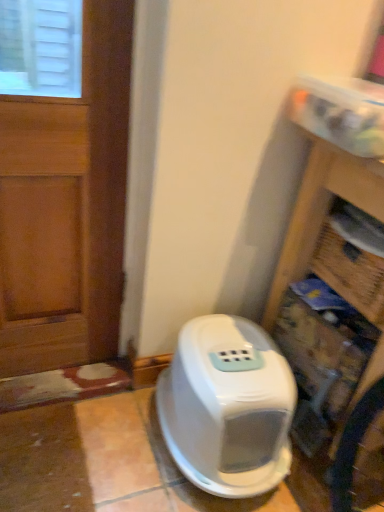
Question: Is wooden door at left aimed at white plastic litter box at lower center?

Choices:
 (A) no
 (B) yes

Answer: (A)

Question: Does wooden door at left appear on the right side of white plastic litter box at lower center?

Choices:
 (A) no
 (B) yes

Answer: (A)

Question: From a real-world perspective, does wooden door at left sit lower than white plastic litter box at lower center?

Choices:
 (A) no
 (B) yes

Answer: (A)

Question: Can you confirm if wooden door at left is smaller than white plastic litter box at lower center?

Choices:
 (A) no
 (B) yes

Answer: (B)

Question: Considering the relative sizes of wooden door at left and white plastic litter box at lower center in the image provided, is wooden door at left shorter than white plastic litter box at lower center?

Choices:
 (A) yes
 (B) no

Answer: (B)

Question: Does wooden door at left come in front of white plastic litter box at lower center?

Choices:
 (A) yes
 (B) no

Answer: (A)

Question: Can you confirm if wooden bookshelf at right is positioned to the left of wooden door at left?

Choices:
 (A) no
 (B) yes

Answer: (A)

Question: Considering the relative sizes of wooden bookshelf at right and wooden door at left in the image provided, is wooden bookshelf at right shorter than wooden door at left?

Choices:
 (A) no
 (B) yes

Answer: (B)

Question: Is wooden door at left a part of wooden bookshelf at right?

Choices:
 (A) no
 (B) yes

Answer: (A)

Question: Considering the relative sizes of wooden bookshelf at right and wooden door at left in the image provided, is wooden bookshelf at right taller than wooden door at left?

Choices:
 (A) no
 (B) yes

Answer: (A)

Question: Considering the relative positions of wooden bookshelf at right and wooden door at left in the image provided, is wooden bookshelf at right in front of wooden door at left?

Choices:
 (A) no
 (B) yes

Answer: (B)

Question: Is wooden bookshelf at right facing towards wooden door at left?

Choices:
 (A) no
 (B) yes

Answer: (B)

Question: Considering the relative sizes of wooden bookshelf at right and white plastic litter box at lower center in the image provided, is wooden bookshelf at right shorter than white plastic litter box at lower center?

Choices:
 (A) yes
 (B) no

Answer: (B)